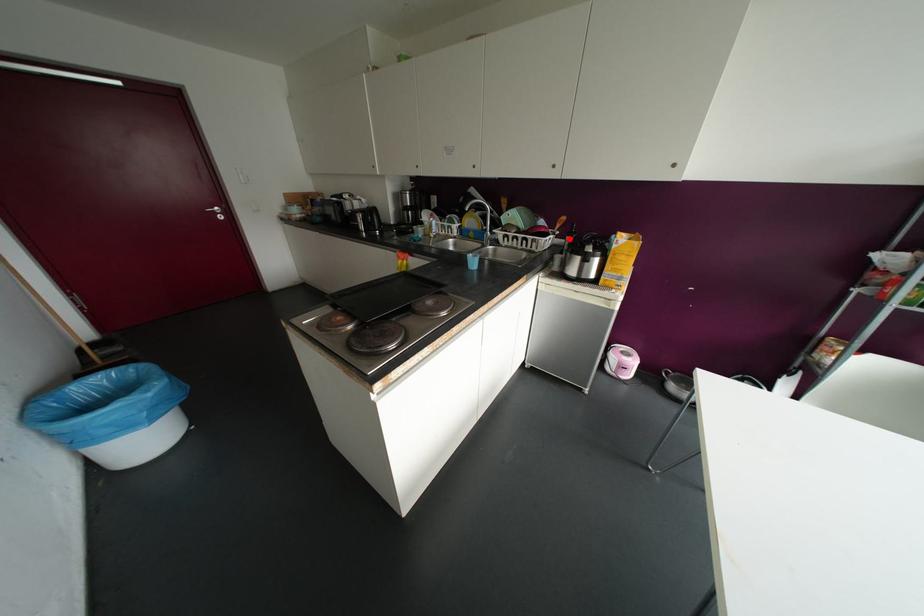
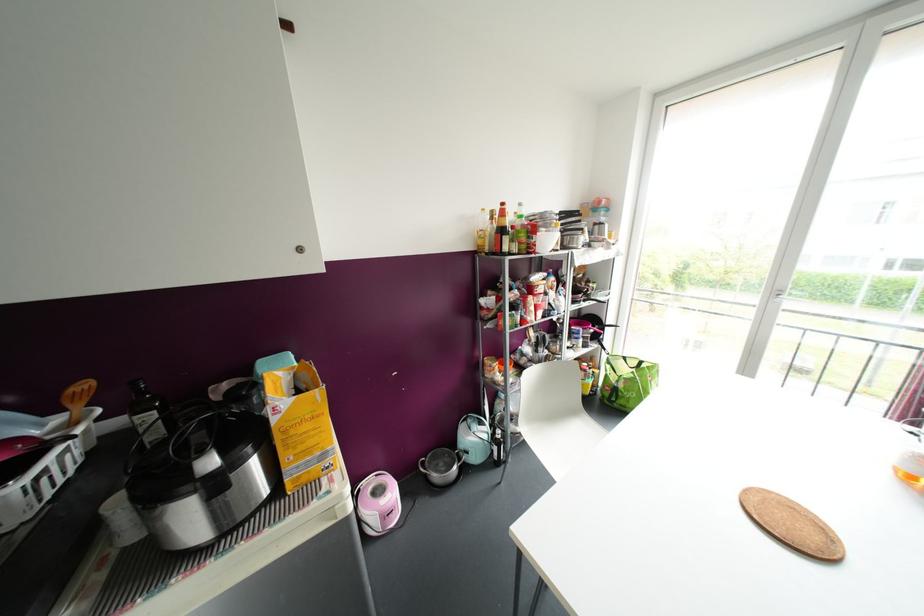
Locate, in the second image, the point that corresponds to the highlighted location in the first image.

(150, 416)